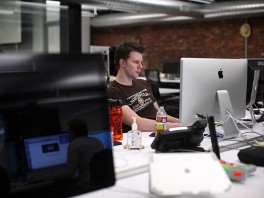
I want to click on computer, so click(x=210, y=76).